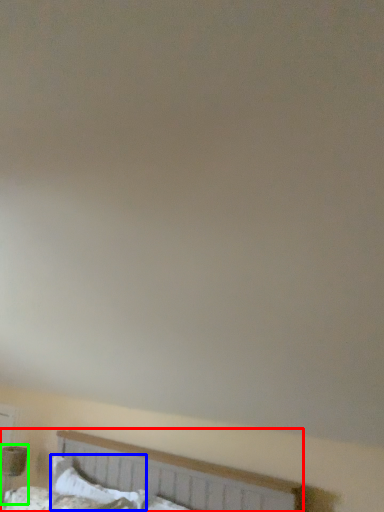
Question: Estimate the real-world distances between objects in this image. Which object is closer to bed (highlighted by a red box), pillow (highlighted by a blue box) or table lamp (highlighted by a green box)?

Choices:
 (A) pillow
 (B) table lamp

Answer: (A)